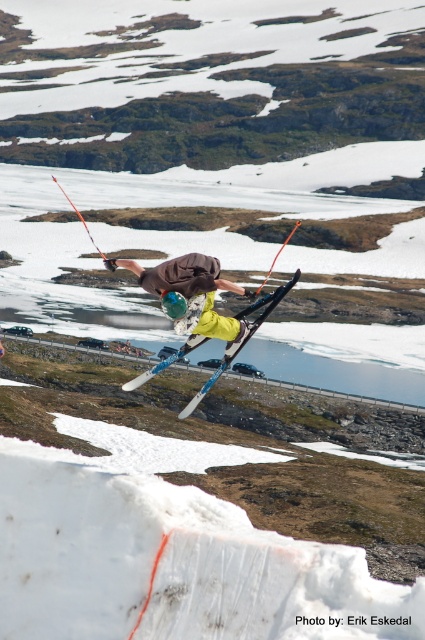
Question: Among these points, which one is farthest from the camera?

Choices:
 (A) (210, 276)
 (B) (136, 381)

Answer: (B)

Question: Which point is farther to the camera?

Choices:
 (A) (204, 392)
 (B) (243, 289)

Answer: (A)

Question: Among these objects, which one is farthest from the camera?

Choices:
 (A) metallic blue skis at center
 (B) matte brown jacket at center

Answer: (A)

Question: Does matte brown jacket at center have a greater width compared to metallic blue skis at center?

Choices:
 (A) no
 (B) yes

Answer: (A)

Question: Can you confirm if matte brown jacket at center is bigger than metallic blue skis at center?

Choices:
 (A) yes
 (B) no

Answer: (B)

Question: Does matte brown jacket at center have a lesser width compared to metallic blue skis at center?

Choices:
 (A) no
 (B) yes

Answer: (B)